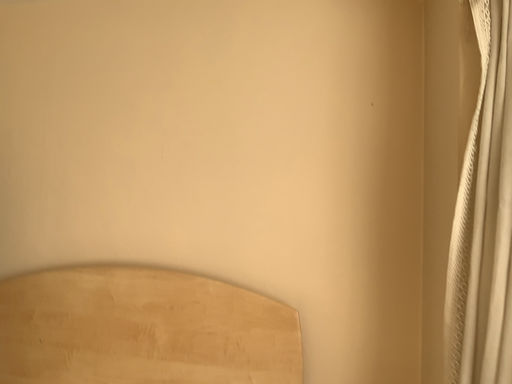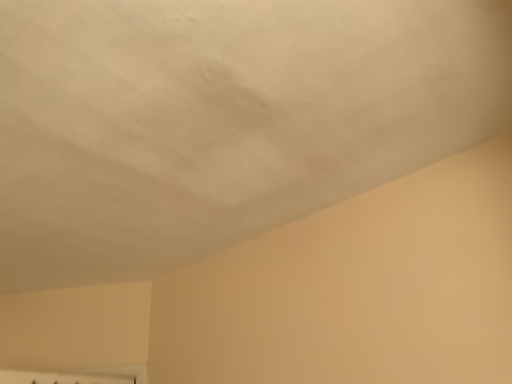
Question: How did the camera likely rotate when shooting the video?

Choices:
 (A) rotated upward
 (B) rotated downward

Answer: (A)